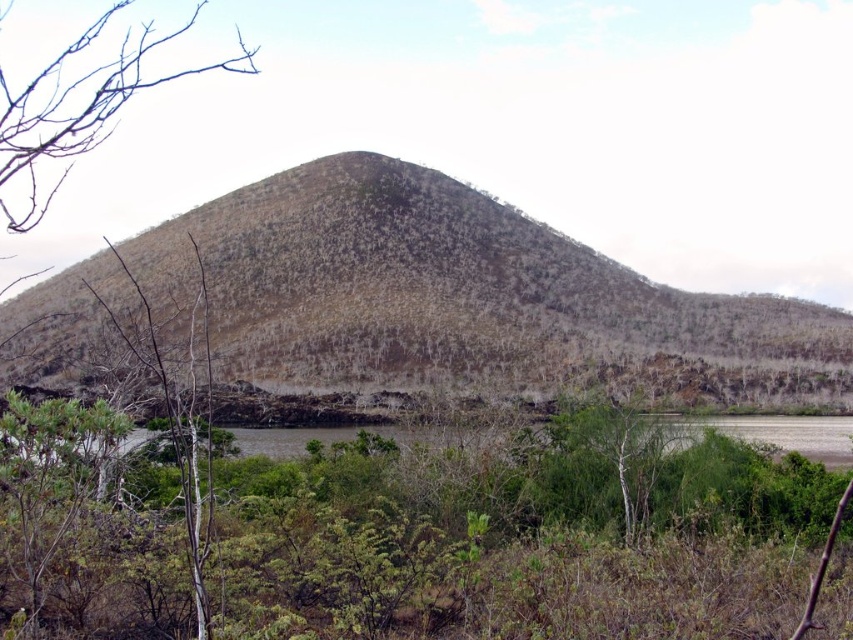
Which of these two, brown textured hill at center or brown bark tree at upper left, stands taller?

With more height is brown bark tree at upper left.

The height and width of the screenshot is (640, 853). Describe the element at coordinates (463, 296) in the screenshot. I see `brown textured hill at center` at that location.

You are a GUI agent. You are given a task and a screenshot of the screen. Output one action in this format:
    pyautogui.click(x=<x>, y=<y>)
    Task: Click on the brown textured hill at center
    This screenshot has width=853, height=640.
    Given the screenshot: What is the action you would take?
    pyautogui.click(x=463, y=296)

Which is more to the right, brown bark tree at upper left or green leafy tree at center?

green leafy tree at center is more to the right.

Is point (21, 168) more distant than point (550, 509)?

Yes, point (21, 168) is behind point (550, 509).

Is point (22, 88) positioned before point (589, 442)?

No.

You are a GUI agent. You are given a task and a screenshot of the screen. Output one action in this format:
    pyautogui.click(x=<x>, y=<y>)
    Task: Click on the brown bark tree at upper left
    This screenshot has height=640, width=853.
    Given the screenshot: What is the action you would take?
    pyautogui.click(x=77, y=112)

Does brown textured hill at center appear under green leafy tree at center?

Incorrect, brown textured hill at center is not positioned below green leafy tree at center.

This screenshot has height=640, width=853. Identify the location of brown textured hill at center. (463, 296).

Between point (837, 387) and point (601, 452), which one is positioned behind?

The point (837, 387) is behind.

Image resolution: width=853 pixels, height=640 pixels. Find the location of `brown textured hill at center`. brown textured hill at center is located at coordinates (463, 296).